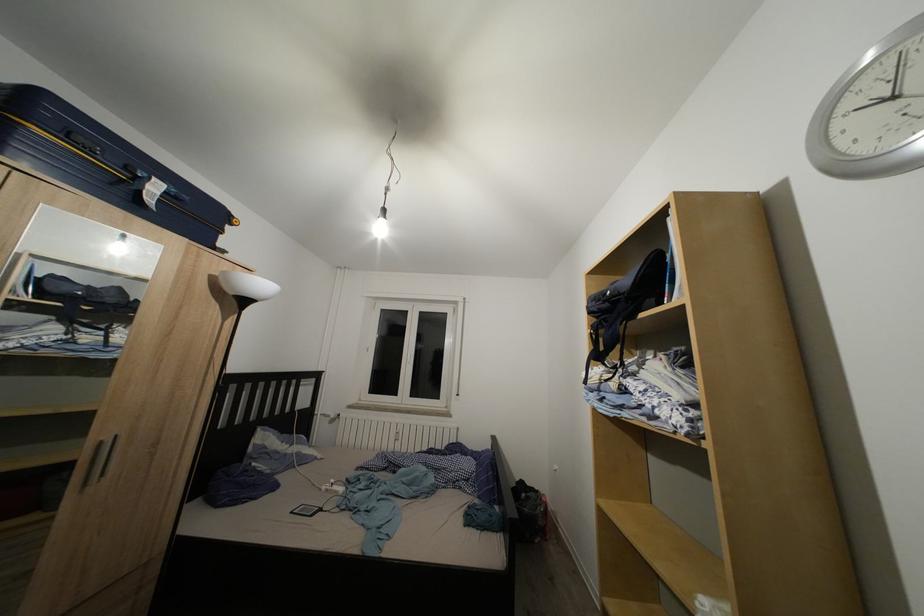
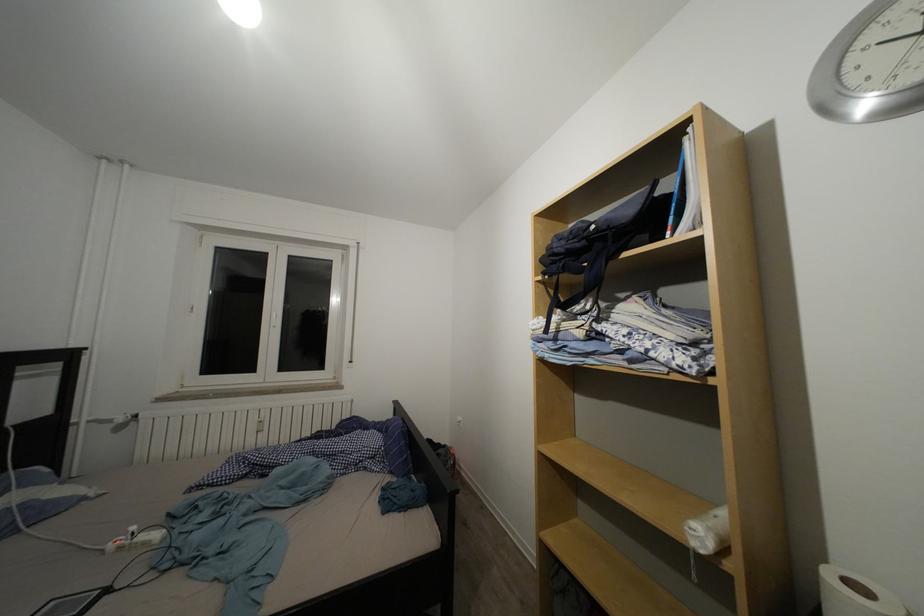
Find the pixel in the second image that matches (341,487) in the first image.

(140, 533)